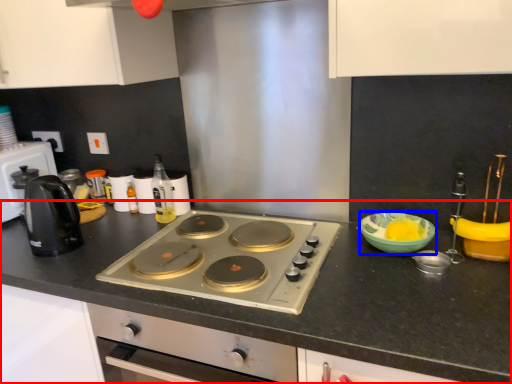
Question: Which object is further to the camera taking this photo, countertop (highlighted by a red box) or bowl (highlighted by a blue box)?

Choices:
 (A) countertop
 (B) bowl

Answer: (B)